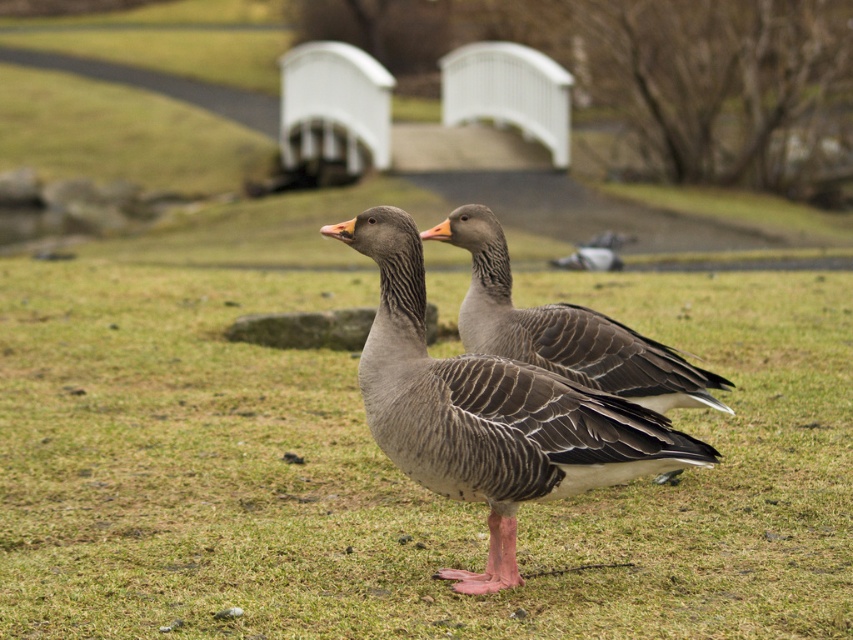
You are standing in a park and see two geese on a grassy area. You want to walk to the point marked at coordinates (509, 412). Is this point within the area where the geese are currently standing?

The point at coordinates (509, 412) is 4.69 meters away from the viewer. Since the geese are on a grassy area and the point is a specific coordinate, it is possible that the point falls within their current standing area. However, without exact measurements of their exact positions, it is difficult to confirm definitively.

You are a birdwatcher observing two birds on a grassy area near a bridge. You see the gray matte duck at center and the gray matte pigeon at center. Which bird is taller?

The gray matte duck at center is taller than the gray matte pigeon at center.

You are a photographer aiming to capture both the gray matte duck at center and the gray matte goose at center in a single frame. Based on their positions, which one is positioned to the left side of the other?

The gray matte duck at center is to the left of the gray matte goose at center.